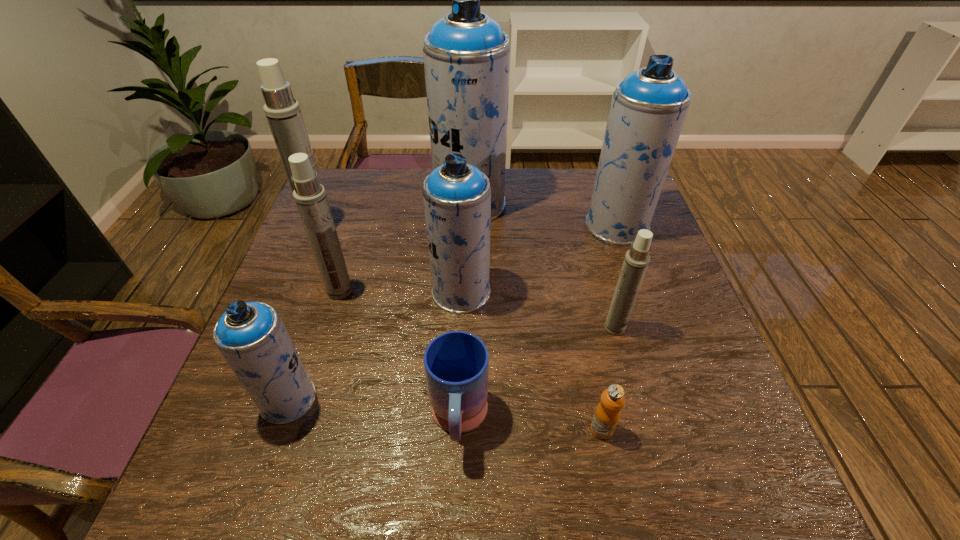
Find the location of a particular element. free space located 0.150m on the left of the second nearest aerosol can is located at coordinates [537, 328].

This screenshot has width=960, height=540. I want to click on vacant area situated 0.110m on the back of the nearest aerosol can, so click(x=311, y=333).

Where is `free location located 0.060m on the side of the eighth tallest object with the handle`? This screenshot has height=540, width=960. free location located 0.060m on the side of the eighth tallest object with the handle is located at coordinates (456, 501).

Identify the location of object present at the near edge. The width and height of the screenshot is (960, 540). (456, 363).

This screenshot has width=960, height=540. Find the location of `object that is at the right edge`. object that is at the right edge is located at coordinates click(x=648, y=109).

Where is `object located in the far right corner section of the desktop`? Image resolution: width=960 pixels, height=540 pixels. object located in the far right corner section of the desktop is located at coordinates (648, 109).

Identify the location of free space at the far edge. (403, 204).

This screenshot has height=540, width=960. In order to click on vacant region at the near edge of the desktop in this screenshot , I will do `click(460, 497)`.

This screenshot has height=540, width=960. Identify the location of vacant space at the right edge. (684, 334).

In order to click on vacant point at the far left corner in this screenshot , I will do `click(334, 189)`.